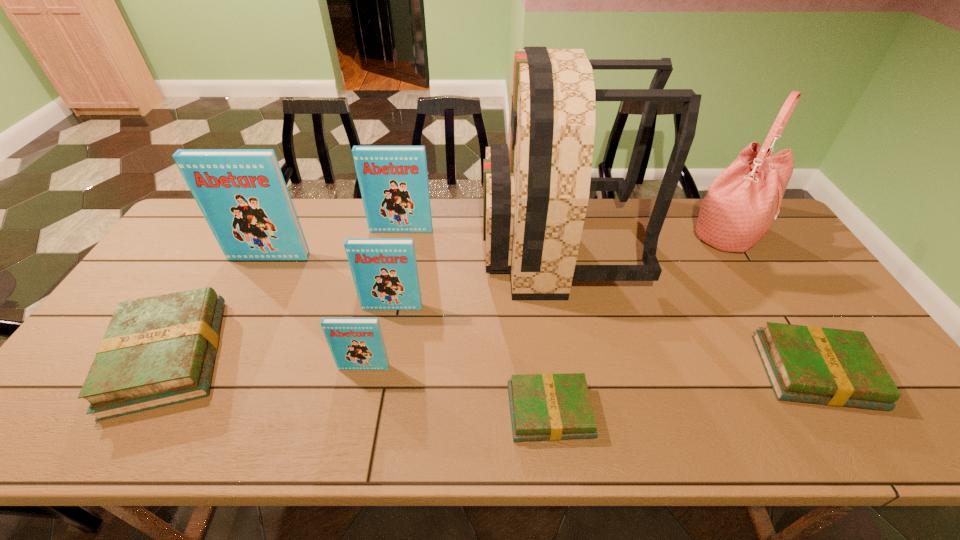
I want to click on the third shortest object, so click(x=157, y=351).

In order to click on the leftmost yellow book in this screenshot , I will do `click(157, 351)`.

Identify the location of the second biggest yellow book. (833, 367).

Image resolution: width=960 pixels, height=540 pixels. Find the location of `the rightmost yellow book`. the rightmost yellow book is located at coordinates (833, 367).

Identify the location of the shortest object. (544, 407).

The width and height of the screenshot is (960, 540). Identify the location of the second yellow book from left to right. (544, 407).

I want to click on vacant position located 0.290m on the front face of the tallest object, so click(x=392, y=245).

At what (x,y) coordinates should I click in order to perform the action: click on free space located on the front face of the tallest object. Please return your answer as a coordinate pair (x, y). The height and width of the screenshot is (540, 960). Looking at the image, I should click on (358, 245).

Where is `blank space located on the front face of the tallest object`? The width and height of the screenshot is (960, 540). blank space located on the front face of the tallest object is located at coordinates (436, 245).

I want to click on free spot located 0.130m on the front of the handbag, so click(x=762, y=292).